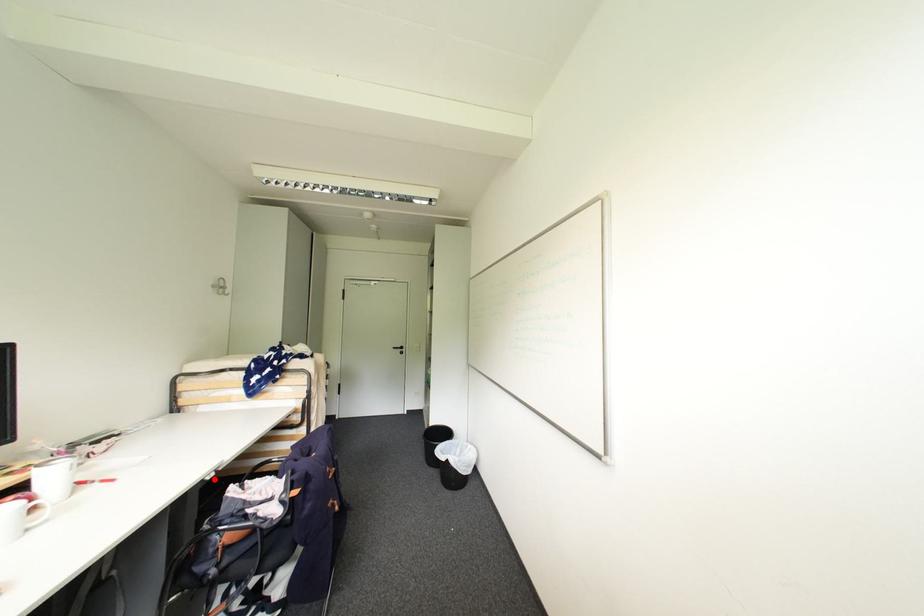
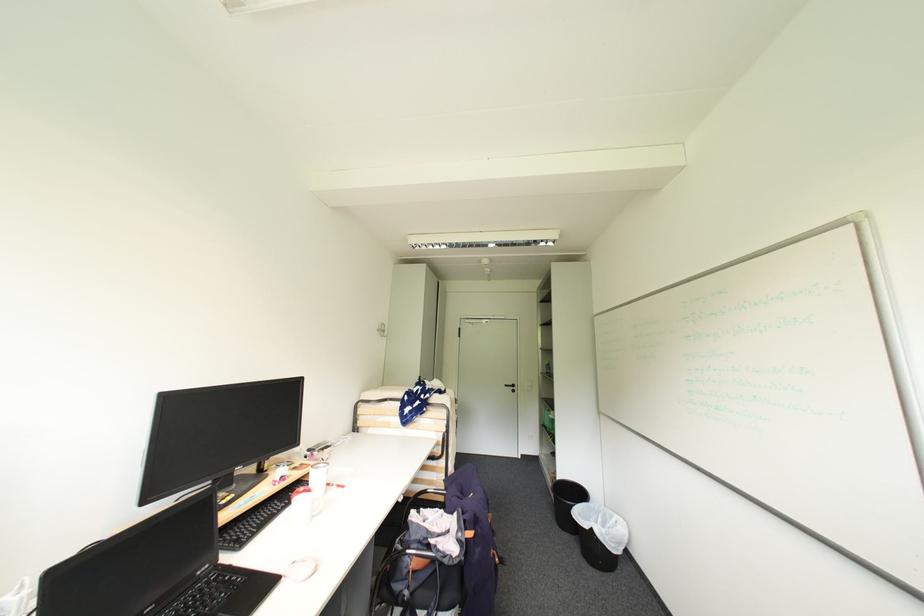
Find the pixel in the second image that matches the highlighted location in the first image.

(407, 501)